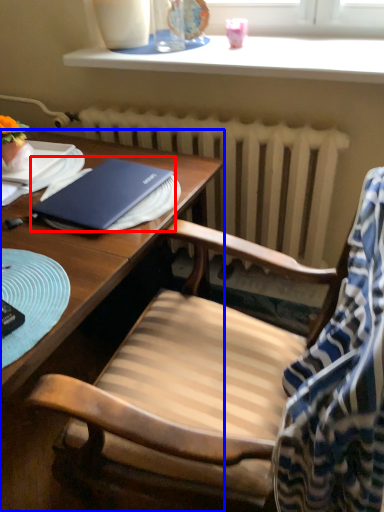
Question: Among these objects, which one is nearest to the camera, notebook (highlighted by a red box) or desk (highlighted by a blue box)?

Choices:
 (A) notebook
 (B) desk

Answer: (B)